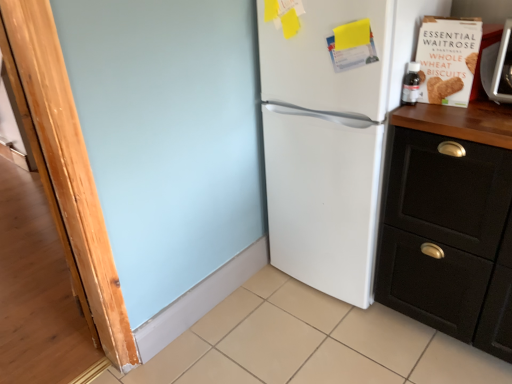
Question: Is black matte cabinet at right shorter than white matte refrigerator at center?

Choices:
 (A) yes
 (B) no

Answer: (A)

Question: Does black matte cabinet at right appear on the left side of white matte refrigerator at center?

Choices:
 (A) yes
 (B) no

Answer: (B)

Question: From a real-world perspective, is black matte cabinet at right physically below white matte refrigerator at center?

Choices:
 (A) yes
 (B) no

Answer: (A)

Question: Could you tell me if black matte cabinet at right is facing white matte refrigerator at center?

Choices:
 (A) yes
 (B) no

Answer: (B)

Question: Considering the relative positions of black matte cabinet at right and white matte refrigerator at center in the image provided, is black matte cabinet at right to the right of white matte refrigerator at center from the viewer's perspective?

Choices:
 (A) no
 (B) yes

Answer: (B)

Question: Does black matte cabinet at right have a larger size compared to white matte refrigerator at center?

Choices:
 (A) yes
 (B) no

Answer: (B)

Question: From a real-world perspective, is white matte refrigerator at center over beige tile at lower center?

Choices:
 (A) no
 (B) yes

Answer: (B)

Question: Does white matte refrigerator at center lie in front of beige tile at lower center?

Choices:
 (A) no
 (B) yes

Answer: (A)

Question: Considering the relative sizes of white matte refrigerator at center and beige tile at lower center in the image provided, is white matte refrigerator at center wider than beige tile at lower center?

Choices:
 (A) no
 (B) yes

Answer: (A)

Question: Is white matte refrigerator at center oriented away from beige tile at lower center?

Choices:
 (A) yes
 (B) no

Answer: (B)

Question: Is white matte refrigerator at center surrounding beige tile at lower center?

Choices:
 (A) no
 (B) yes

Answer: (A)

Question: Is white matte refrigerator at center outside beige tile at lower center?

Choices:
 (A) no
 (B) yes

Answer: (B)

Question: From a real-world perspective, is beige tile at lower center beneath white matte refrigerator at center?

Choices:
 (A) yes
 (B) no

Answer: (A)